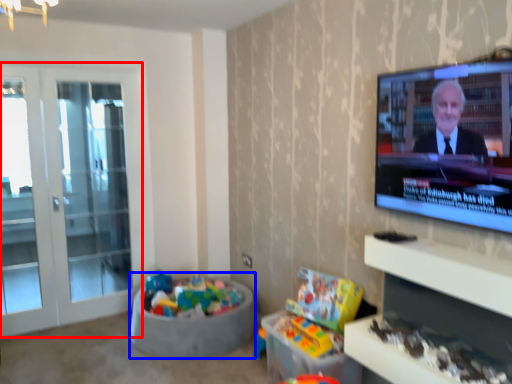
Question: Which object appears closest to the camera in this image, screen door (highlighted by a red box) or bean bag chair (highlighted by a blue box)?

Choices:
 (A) screen door
 (B) bean bag chair

Answer: (B)